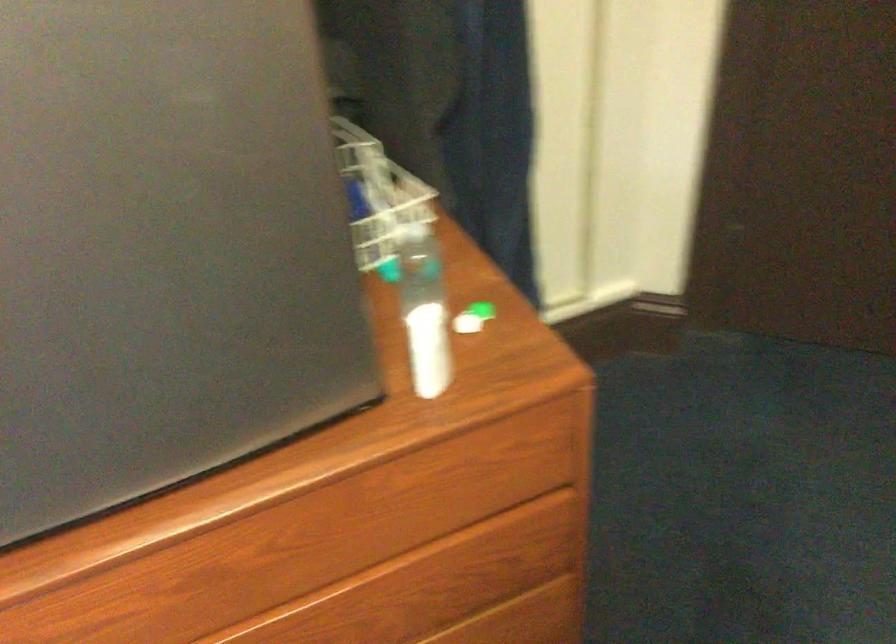
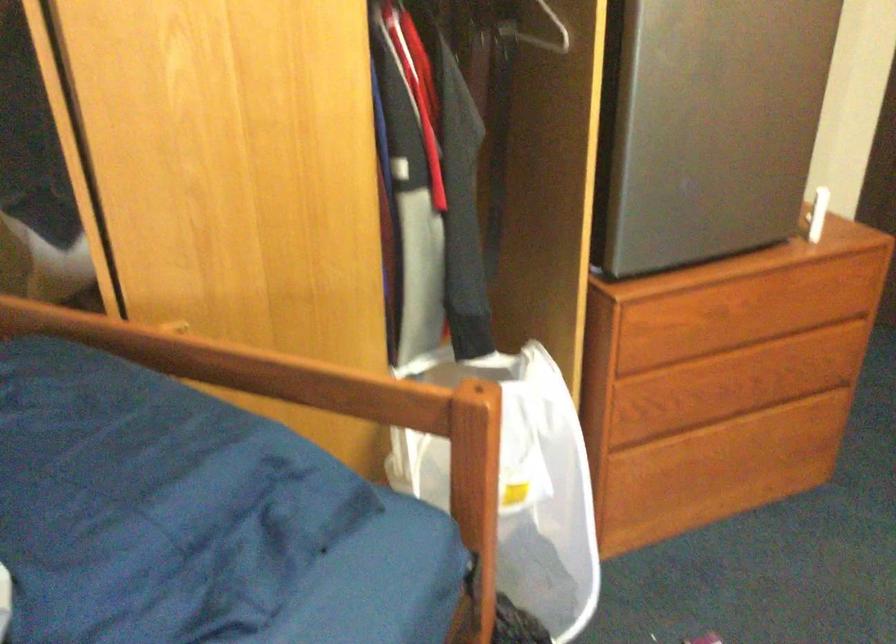
The images are taken continuously from a first-person perspective. In which direction are you moving?

The movement direction of the cameraman is left, backward.